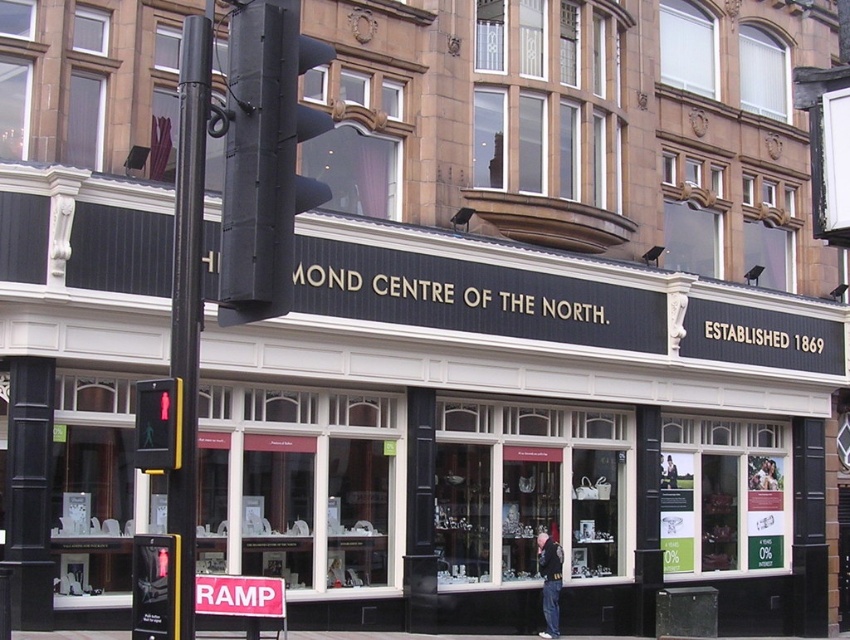
Where is `black plastic traffic light at upper center`? black plastic traffic light at upper center is located at coordinates (264, 156).

Measure the distance from red plastic pedestrian signal at left to pink plastic sign at lower center.

red plastic pedestrian signal at left and pink plastic sign at lower center are 7.05 meters apart from each other.

Who is higher up, red plastic pedestrian signal at left or pink plastic sign at lower center?

red plastic pedestrian signal at left is above.

What do you see at coordinates (157, 424) in the screenshot? This screenshot has width=850, height=640. I see `red plastic pedestrian signal at left` at bounding box center [157, 424].

Find the location of `red plastic pedestrian signal at left`. red plastic pedestrian signal at left is located at coordinates (157, 424).

What do you see at coordinates (537, 397) in the screenshot?
I see `black glass storefront at center` at bounding box center [537, 397].

In the scene shown: Which is above, black glass storefront at center or black metal pole at left?

black glass storefront at center is higher up.

Between point (375, 540) and point (173, 522), which one is positioned behind?

Positioned behind is point (375, 540).

Locate an element on the screen. black glass storefront at center is located at coordinates (537, 397).